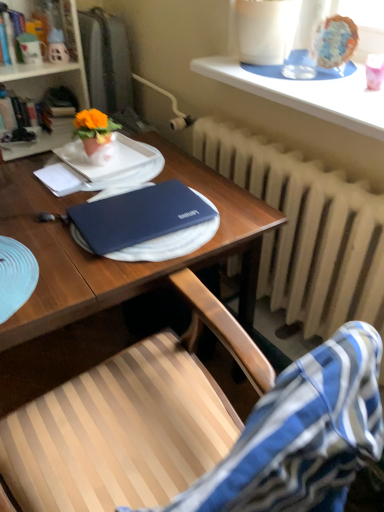
Question: From a real-world perspective, is matte orange flowerpot at upper left physically above matte ceramic mug at upper left?

Choices:
 (A) no
 (B) yes

Answer: (A)

Question: From the image's perspective, is matte orange flowerpot at upper left located beneath matte ceramic mug at upper left?

Choices:
 (A) no
 (B) yes

Answer: (B)

Question: Is matte orange flowerpot at upper left bigger than matte ceramic mug at upper left?

Choices:
 (A) yes
 (B) no

Answer: (B)

Question: Can you confirm if matte orange flowerpot at upper left is positioned to the left of matte ceramic mug at upper left?

Choices:
 (A) no
 (B) yes

Answer: (A)

Question: Are matte orange flowerpot at upper left and matte ceramic mug at upper left located far from each other?

Choices:
 (A) yes
 (B) no

Answer: (B)

Question: Is matte orange flowerpot at upper left turned away from matte ceramic mug at upper left?

Choices:
 (A) no
 (B) yes

Answer: (A)

Question: Is white textured radiator at center oriented away from glazed ceramic cake at upper right?

Choices:
 (A) no
 (B) yes

Answer: (A)

Question: Is white textured radiator at center far away from glazed ceramic cake at upper right?

Choices:
 (A) yes
 (B) no

Answer: (B)

Question: Considering the relative sizes of white textured radiator at center and glazed ceramic cake at upper right in the image provided, is white textured radiator at center smaller than glazed ceramic cake at upper right?

Choices:
 (A) yes
 (B) no

Answer: (B)

Question: From the image's perspective, is white textured radiator at center below glazed ceramic cake at upper right?

Choices:
 (A) yes
 (B) no

Answer: (A)

Question: Considering the relative sizes of white textured radiator at center and glazed ceramic cake at upper right in the image provided, is white textured radiator at center wider than glazed ceramic cake at upper right?

Choices:
 (A) yes
 (B) no

Answer: (A)

Question: Considering the relative positions of white textured radiator at center and glazed ceramic cake at upper right in the image provided, is white textured radiator at center behind glazed ceramic cake at upper right?

Choices:
 (A) no
 (B) yes

Answer: (A)

Question: Is white paper at left closer to the viewer compared to matte ceramic mug at upper left?

Choices:
 (A) yes
 (B) no

Answer: (A)